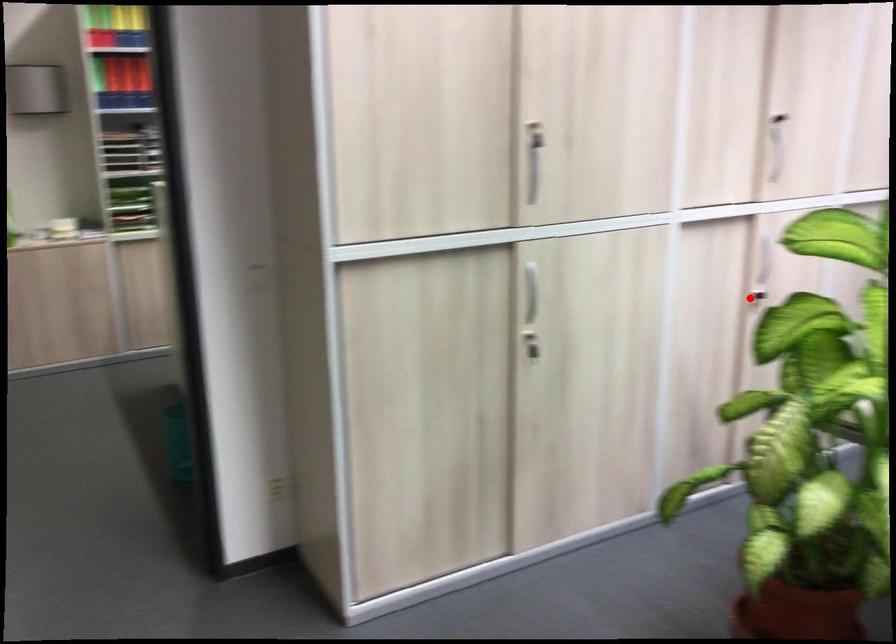
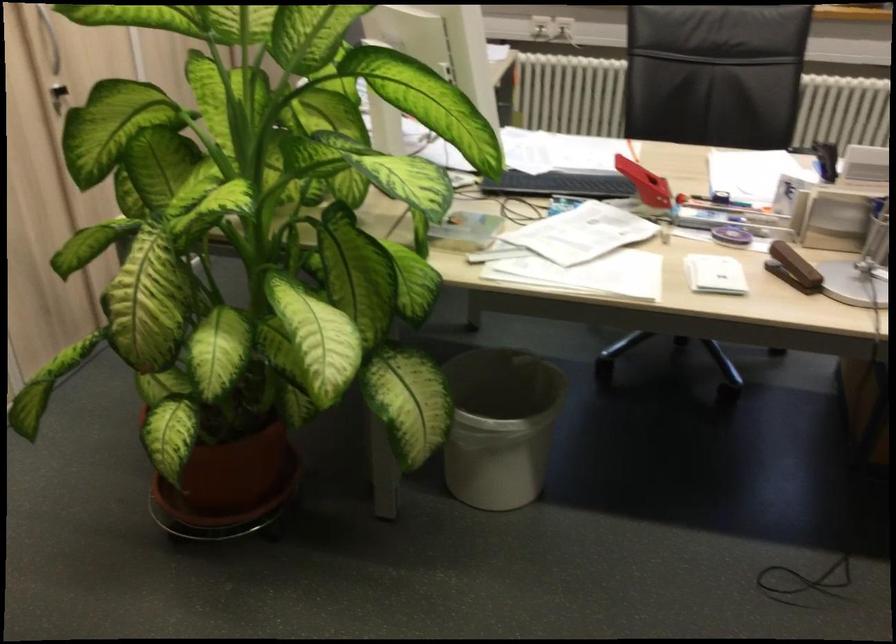
Question: I am providing you with two images of the same scene from different viewpoints. In image1, a red point is highlighted. Considering the same 3D point in image2, which of the following is correct?

Choices:
 (A) It is closer
 (B) It is farther

Answer: (A)